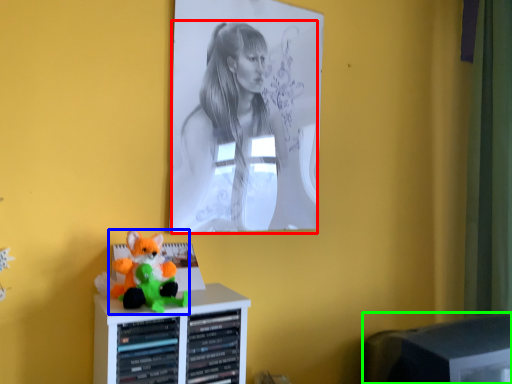
Question: Which object is the closest to the person (highlighted by a red box)? Choose among these: toy (highlighted by a blue box) or computer monitor (highlighted by a green box).

Choices:
 (A) toy
 (B) computer monitor

Answer: (A)